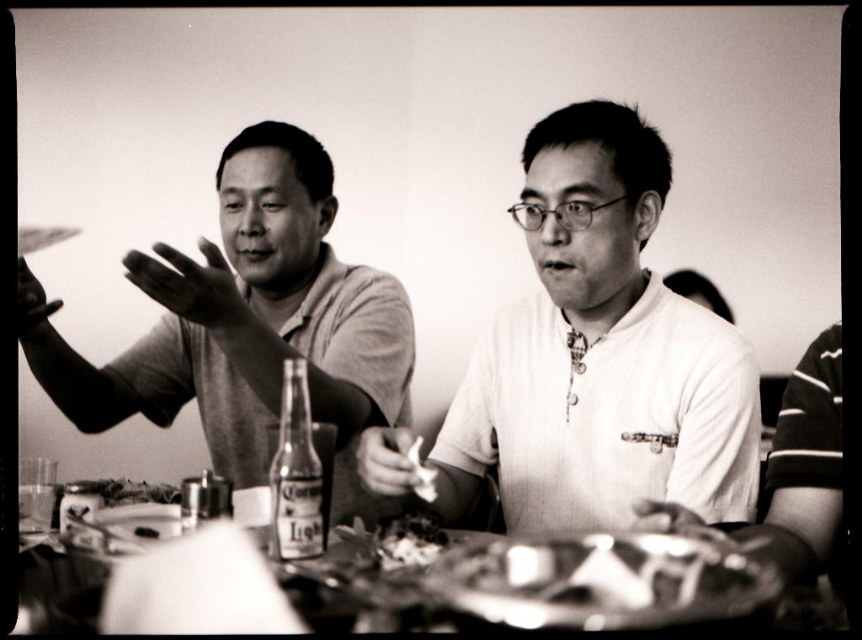
Question: Does white textured shirt at center appear on the left side of dark textured food at center?

Choices:
 (A) no
 (B) yes

Answer: (A)

Question: Which point is farther to the camera?

Choices:
 (A) metallic silver tray at lower center
 (B) white textured shirt at center

Answer: (B)

Question: Which of the following is the farthest from the observer?

Choices:
 (A) (429, 550)
 (B) (303, 419)
 (C) (736, 570)

Answer: (B)

Question: Can you confirm if matte gray shirt at left is positioned to the left of metallic silver tray at lower center?

Choices:
 (A) yes
 (B) no

Answer: (A)

Question: In this image, where is matte gray shirt at left located relative to dark textured food at center?

Choices:
 (A) right
 (B) left

Answer: (B)

Question: Which object is closer to the camera taking this photo?

Choices:
 (A) clear glass bottle at center
 (B) matte gray shirt at left
 (C) smooth white plate at center

Answer: (C)